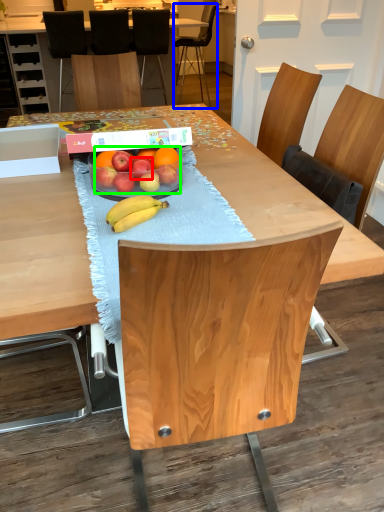
Question: Which is nearer to the apple (highlighted by a red box)? chair (highlighted by a blue box) or grapefruit (highlighted by a green box).

Choices:
 (A) chair
 (B) grapefruit

Answer: (B)